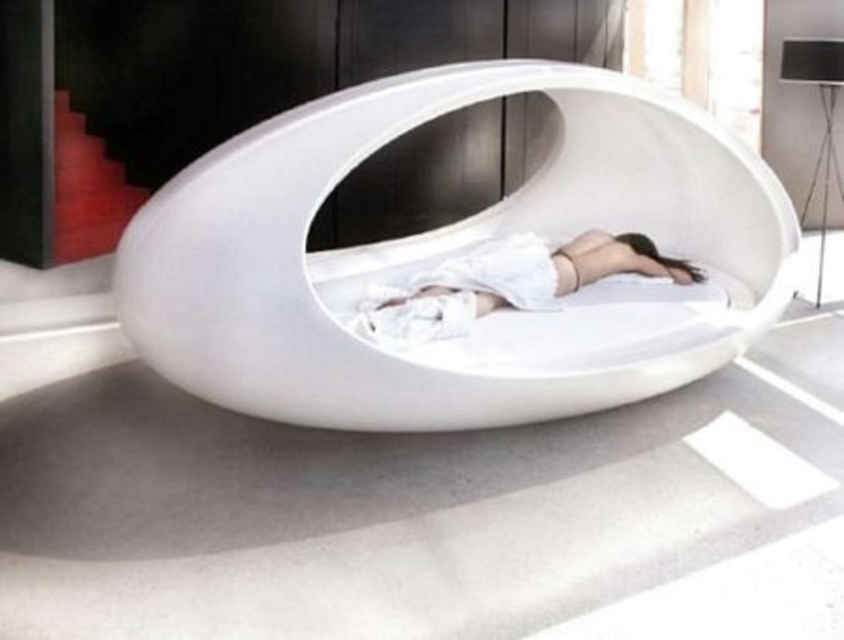
In the scene shown: You are a delivery person who needs to place a rectangular package that is 16 inches long on the floor next to the white glossy bed at center and the white matte fabric at center. Can you fit the package between them without overlapping either object?

The distance between the white glossy bed at center and the white matte fabric at center is 17.09 inches. Since the package is 16 inches long, it can fit between them as the available space is slightly larger than the package.

Consider the image. You are standing at the entrance of the room and want to approach the white glossy bed at center. According to the coordinates provided, in which direction should you move from your current position to reach the bed?

The white glossy bed at center is located at coordinates point (448,252). Since you are at the entrance, you should move towards the center of the room to reach the bed.